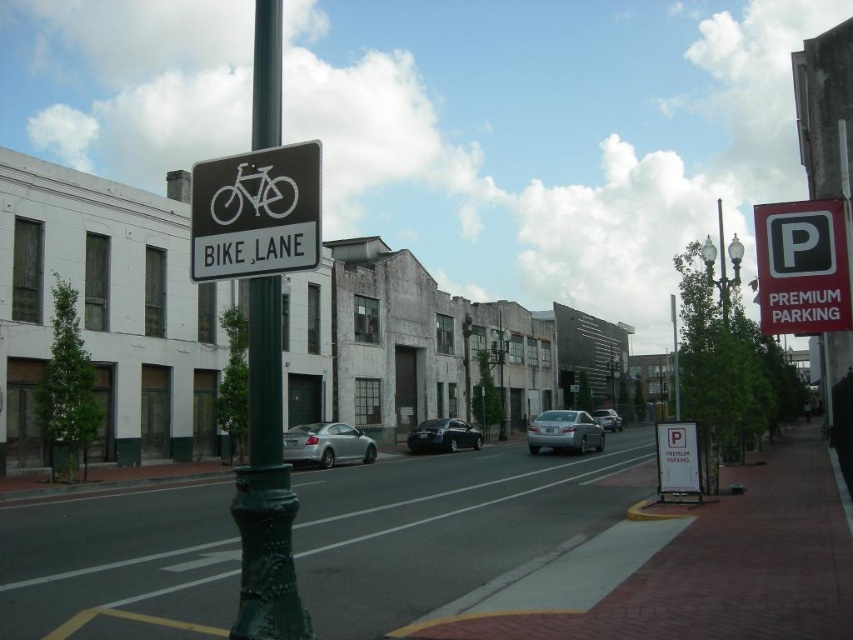
Consider the image. Is the position of white plastic bike lane sign at upper center less distant than that of silver metallic sedan at center?

Yes, it is.

Can you confirm if white plastic bike lane sign at upper center is smaller than silver metallic sedan at center?

Actually, white plastic bike lane sign at upper center might be larger than silver metallic sedan at center.

Is point (303, 200) behind point (604, 416)?

No, it is not.

Identify the location of white plastic bike lane sign at upper center. (256, 212).

Is red plastic parking sign at upper right below silver metallic sedan at center?

Actually, red plastic parking sign at upper right is above silver metallic sedan at center.

Who is more forward, (828, 202) or (619, 426)?

Point (828, 202) is more forward.

Between point (811, 218) and point (604, 428), which one is positioned behind?

Positioned behind is point (604, 428).

Where is `red plastic parking sign at upper right`? The image size is (853, 640). red plastic parking sign at upper right is located at coordinates (802, 268).

Between white plastic bike lane sign at upper center and metallic gray streetlamp at center, which one is positioned lower?

metallic gray streetlamp at center is lower down.

Is point (216, 198) closer to camera compared to point (463, 394)?

Yes, point (216, 198) is in front of point (463, 394).

At what (x,y) coordinates should I click in order to perform the action: click on white plastic bike lane sign at upper center. Please return your answer as a coordinate pair (x, y). Looking at the image, I should click on (256, 212).